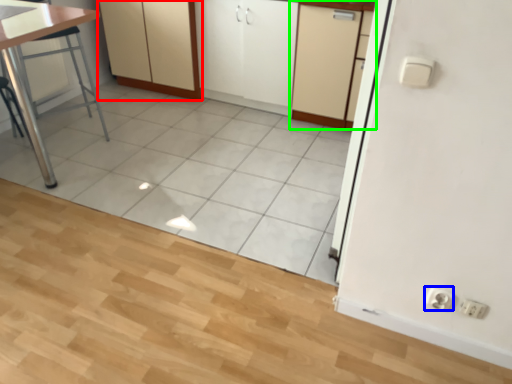
Question: Which object is the farthest from cabinetry (highlighted by a red box)? Choose among these: electric outlet (highlighted by a blue box) or cabinetry (highlighted by a green box).

Choices:
 (A) electric outlet
 (B) cabinetry

Answer: (A)